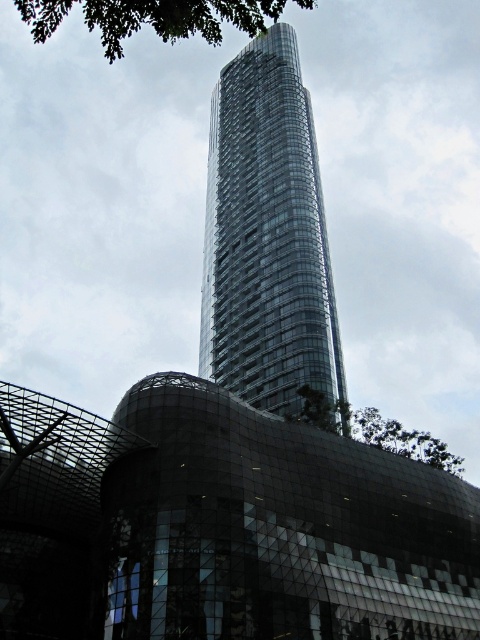
Question: Which point is farther from the camera taking this photo?

Choices:
 (A) (328, 346)
 (B) (422, 452)
 (C) (99, 4)

Answer: (A)

Question: Among these objects, which one is farthest from the camera?

Choices:
 (A) transparent glass tower at center
 (B) green leafy tree at upper center
 (C) green leafy tree at upper left

Answer: (A)

Question: Does green leafy tree at upper left lie in front of green leafy tree at upper center?

Choices:
 (A) yes
 (B) no

Answer: (A)

Question: Which of the following is the farthest from the observer?

Choices:
 (A) green leafy tree at upper center
 (B) transparent glass tower at center

Answer: (B)

Question: Can you confirm if green leafy tree at upper left is bigger than green leafy tree at upper center?

Choices:
 (A) yes
 (B) no

Answer: (A)

Question: Does green leafy tree at upper left appear on the left side of green leafy tree at upper center?

Choices:
 (A) no
 (B) yes

Answer: (B)